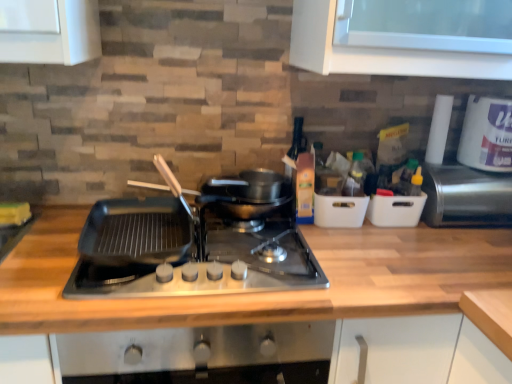
Question: From a real-world perspective, is white plastic container at right, marked as the 2th appliance in a right-to-left arrangement, positioned above or below black matte griddle at center?

Choices:
 (A) below
 (B) above

Answer: (B)

Question: Visually, is white plastic container at right, marked as the 2th appliance in a right-to-left arrangement, positioned to the left or to the right of black matte griddle at center?

Choices:
 (A) left
 (B) right

Answer: (B)

Question: Estimate the real-world distances between objects in this image. Which object is closer to the wooden at center?

Choices:
 (A) metallic stainless steel toaster at right, which is counted as the 2th appliance, starting from the left
 (B) black matte wok at center
 (C) black matte griddle at center
 (D) white plastic container at upper right
 (E) white plastic container at right, marked as the 2th appliance in a right-to-left arrangement

Answer: (C)

Question: Which object is positioned farthest from the black matte wok at center?

Choices:
 (A) metallic stainless steel toaster at right, which is counted as the 2th appliance, starting from the left
 (B) white plastic container at upper right
 (C) black matte griddle at center
 (D) white plastic container at right, the 1th appliance when ordered from left to right
 (E) wooden at center

Answer: (B)